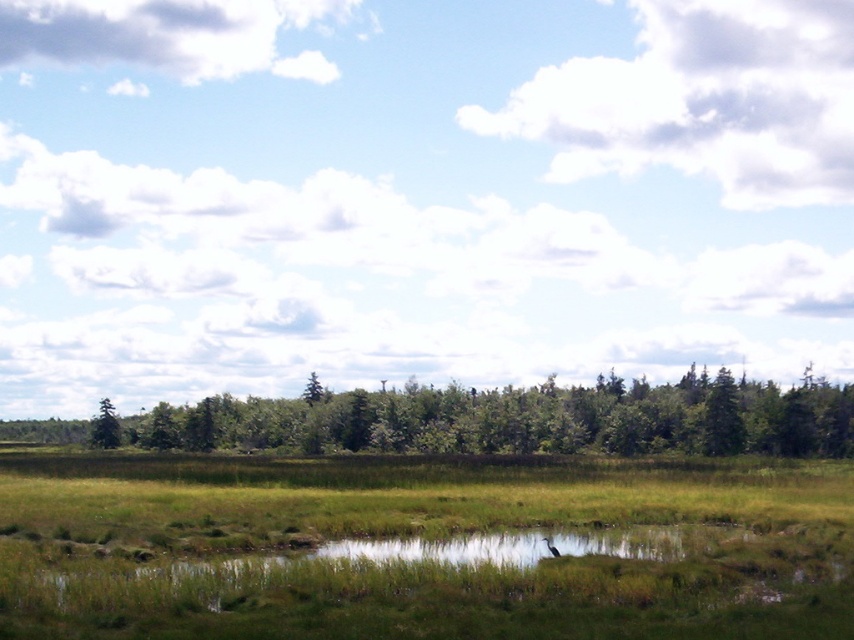
Who is more distant from viewer, (161,440) or (115,429)?

Point (115,429)

Does green leafy trees at center appear on the left side of green matte tree at left?

No, green leafy trees at center is not to the left of green matte tree at left.

Is point (588, 406) closer to camera compared to point (98, 412)?

Yes, it is.

This screenshot has height=640, width=854. Find the location of `green leafy trees at center`. green leafy trees at center is located at coordinates (519, 419).